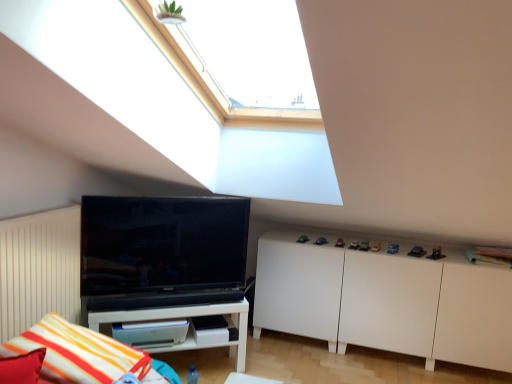
Question: From a real-world perspective, is white glossy shelf at lower left on white matte cabinet at lower right?

Choices:
 (A) yes
 (B) no

Answer: (B)

Question: Is white glossy shelf at lower left looking in the opposite direction of white matte cabinet at lower right?

Choices:
 (A) no
 (B) yes

Answer: (A)

Question: Can you confirm if white glossy shelf at lower left is positioned to the right of white matte cabinet at lower right?

Choices:
 (A) no
 (B) yes

Answer: (A)

Question: Considering the relative positions of white glossy shelf at lower left and white matte cabinet at lower right in the image provided, is white glossy shelf at lower left behind white matte cabinet at lower right?

Choices:
 (A) yes
 (B) no

Answer: (B)

Question: Is white glossy shelf at lower left facing towards white matte cabinet at lower right?

Choices:
 (A) yes
 (B) no

Answer: (B)

Question: Can you confirm if white glossy shelf at lower left is thinner than white matte cabinet at lower right?

Choices:
 (A) yes
 (B) no

Answer: (A)

Question: Considering the relative sizes of white matte cabinet at lower right and white glossy shelf at lower left in the image provided, is white matte cabinet at lower right smaller than white glossy shelf at lower left?

Choices:
 (A) yes
 (B) no

Answer: (B)

Question: Is white glossy shelf at lower left a part of white matte cabinet at lower right?

Choices:
 (A) yes
 (B) no

Answer: (B)

Question: Does white matte cabinet at lower right have a greater width compared to white glossy shelf at lower left?

Choices:
 (A) yes
 (B) no

Answer: (A)

Question: Does white matte cabinet at lower right have a greater height compared to white glossy shelf at lower left?

Choices:
 (A) yes
 (B) no

Answer: (A)

Question: Is the depth of white matte cabinet at lower right greater than that of white glossy shelf at lower left?

Choices:
 (A) no
 (B) yes

Answer: (B)

Question: Can you confirm if white matte cabinet at lower right is shorter than white glossy shelf at lower left?

Choices:
 (A) yes
 (B) no

Answer: (B)

Question: From the image's perspective, is striped fabric pillow at lower left located beneath white matte cabinet at lower right?

Choices:
 (A) yes
 (B) no

Answer: (A)